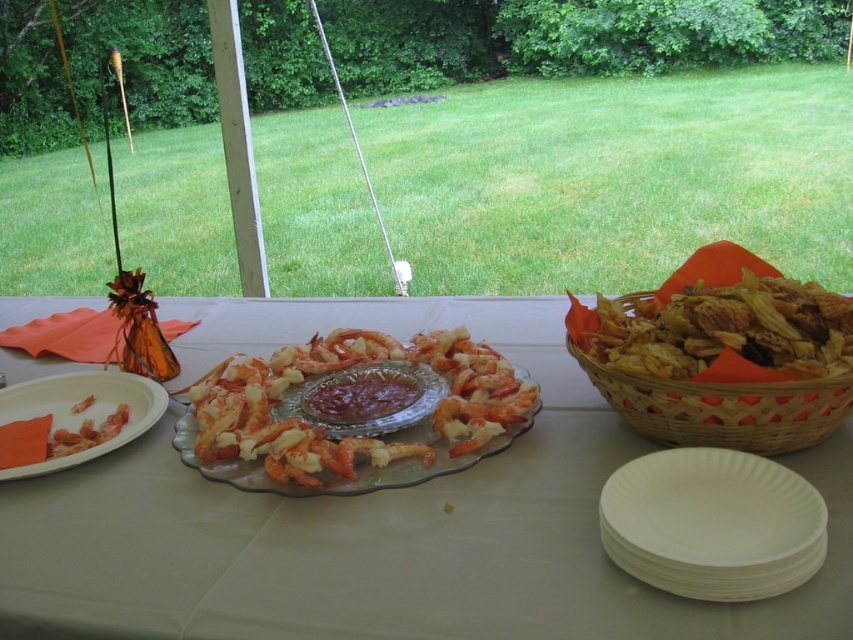
Who is higher up, shiny glass platter at center or shiny red sauce at center?

shiny red sauce at center

Is shiny glass platter at center to the left of shiny red sauce at center from the viewer's perspective?

In fact, shiny glass platter at center is to the right of shiny red sauce at center.

Is point (289, 486) positioned in front of point (334, 376)?

Yes, point (289, 486) is in front of point (334, 376).

Where is `shiny glass platter at center`? shiny glass platter at center is located at coordinates (355, 465).

Between translucent glass plate at center and woven brown basket at right, which one is positioned higher?

woven brown basket at right is above.

Does translucent glass plate at center have a lesser height compared to woven brown basket at right?

In fact, translucent glass plate at center may be taller than woven brown basket at right.

The width and height of the screenshot is (853, 640). Identify the location of translucent glass plate at center. (379, 518).

Locate an element on the screen. This screenshot has width=853, height=640. translucent glass plate at center is located at coordinates (379, 518).

Is point (799, 580) closer to camera compared to point (798, 388)?

Yes, it is in front of point (798, 388).

Is white paper plates at lower right bigger than woven brown basket at right?

No, white paper plates at lower right is not bigger than woven brown basket at right.

You are a GUI agent. You are given a task and a screenshot of the screen. Output one action in this format:
    pyautogui.click(x=<x>, y=<y>)
    Task: Click on the white paper plates at lower right
    
    Given the screenshot: What is the action you would take?
    pyautogui.click(x=712, y=524)